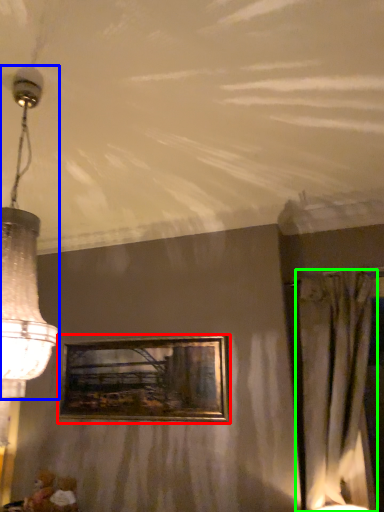
Question: Estimate the real-world distances between objects in this image. Which object is closer to picture frame (highlighted by a red box), lamp (highlighted by a blue box) or curtain (highlighted by a green box)?

Choices:
 (A) lamp
 (B) curtain

Answer: (B)